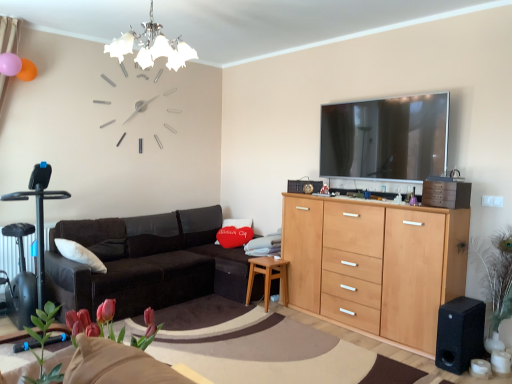
I want to click on green leafy plant at lower left, the first plant viewed from the left, so click(42, 344).

What do you see at coordinates (42, 344) in the screenshot? I see `green leafy plant at lower left, arranged as the first plant when viewed from the front` at bounding box center [42, 344].

The height and width of the screenshot is (384, 512). What do you see at coordinates (234, 236) in the screenshot?
I see `velvety red heart at center` at bounding box center [234, 236].

Find the location of `black matte speaker at lower right`. black matte speaker at lower right is located at coordinates (460, 334).

Measure the distance between beech wood cabinet at center and camera.

beech wood cabinet at center is 3.03 meters away from camera.

Describe the element at coordinates (147, 262) in the screenshot. I see `black leather couch at center` at that location.

In order to face black leather couch at center, should I rotate leftwards or rightwards?

Turn left approximately 10.867 degrees to face it.

The image size is (512, 384). What are the coordinates of `chrome/textured glass chandelier at upper center` in the screenshot? It's located at (151, 46).

This screenshot has height=384, width=512. What do you see at coordinates (151, 46) in the screenshot?
I see `chrome/textured glass chandelier at upper center` at bounding box center [151, 46].

This screenshot has width=512, height=384. Find the location of `pink matte tulips at lower left, the second plant from the right`. pink matte tulips at lower left, the second plant from the right is located at coordinates (94, 322).

Locate an element on the screen. green leafy plant at lower left, the first plant viewed from the left is located at coordinates (42, 344).

Is pink rubber balloon at upper left, marked as the 1th balloon in a front-to-back arrangement, at the right side of velvety red heart at center?

No.

Who is smaller, pink rubber balloon at upper left, marked as the 1th balloon in a front-to-back arrangement, or velvety red heart at center?

Smaller between the two is pink rubber balloon at upper left, marked as the 1th balloon in a front-to-back arrangement.

Considering the positions of objects pink rubber balloon at upper left, which ranks as the 2th balloon in back-to-front order, and velvety red heart at center in the image provided, who is behind, pink rubber balloon at upper left, which ranks as the 2th balloon in back-to-front order, or velvety red heart at center?

velvety red heart at center.

From the image's perspective, would you say pink rubber balloon at upper left, which ranks as the 2th balloon in back-to-front order, is positioned over beech wood cabinet at center?

Yes, from the image's perspective, pink rubber balloon at upper left, which ranks as the 2th balloon in back-to-front order, is above beech wood cabinet at center.

Consider the image. Is pink rubber balloon at upper left, which ranks as the 2th balloon in back-to-front order, inside the boundaries of beech wood cabinet at center, or outside?

pink rubber balloon at upper left, which ranks as the 2th balloon in back-to-front order, is spatially situated outside beech wood cabinet at center.

Does pink rubber balloon at upper left, marked as the 1th balloon in a front-to-back arrangement, have a lesser width compared to beech wood cabinet at center?

Yes.

Locate an element on the screen. chest of drawers to the right of pink rubber balloon at upper left, marked as the 1th balloon in a front-to-back arrangement is located at coordinates (375, 265).

This screenshot has width=512, height=384. There is a beech wood cabinet at center. Identify the location of the 1st plant above it (from a real-world perspective). (495, 280).

Is beech wood cabinet at center completely or partially outside of green leafy plant at right, placed as the 3th plant when sorted from front to back?

Yes, beech wood cabinet at center is located beyond the bounds of green leafy plant at right, placed as the 3th plant when sorted from front to back.

Can you confirm if beech wood cabinet at center is positioned to the left of green leafy plant at right, placed as the 3th plant when sorted from front to back?

Yes, beech wood cabinet at center is to the left of green leafy plant at right, placed as the 3th plant when sorted from front to back.

Is green leafy plant at lower left, the third plant viewed from the right, not within black leather couch at center?

Yes.

From a real-world perspective, is green leafy plant at lower left, the first plant viewed from the left, positioned under black leather couch at center based on gravity?

No, from a real-world perspective, green leafy plant at lower left, the first plant viewed from the left, is not under black leather couch at center.

From the image's perspective, is green leafy plant at lower left, the third plant viewed from the right, positioned above or below black leather couch at center?

From the image's perspective, green leafy plant at lower left, the third plant viewed from the right, appears above black leather couch at center.

Considering the relative sizes of green leafy plant at lower left, the third plant viewed from the right, and black leather couch at center in the image provided, is green leafy plant at lower left, the third plant viewed from the right, thinner than black leather couch at center?

Yes.

How different are the orientations of green leafy plant at right, which ranks as the 1th plant in right-to-left order, and black leather couch at center in degrees?

90.3 degrees separate the facing orientations of green leafy plant at right, which ranks as the 1th plant in right-to-left order, and black leather couch at center.

Where is `plant that appears below the black leather couch at center (from the image's perspective)`? The width and height of the screenshot is (512, 384). plant that appears below the black leather couch at center (from the image's perspective) is located at coordinates (495, 280).

Is green leafy plant at right, placed as the 3th plant when sorted from front to back, touching black leather couch at center?

green leafy plant at right, placed as the 3th plant when sorted from front to back, is not next to black leather couch at center, and they're not touching.

Considering the relative sizes of green leafy plant at right, which ranks as the 1th plant in right-to-left order, and black leather couch at center in the image provided, is green leafy plant at right, which ranks as the 1th plant in right-to-left order, smaller than black leather couch at center?

Yes.

Is matte orange balloon at upper left, the second balloon viewed from the front, not within green leafy plant at lower left, arranged as the first plant when viewed from the front?

matte orange balloon at upper left, the second balloon viewed from the front, is positioned outside green leafy plant at lower left, arranged as the first plant when viewed from the front.

Is matte orange balloon at upper left, the 1th balloon in the back-to-front sequence, aimed at green leafy plant at lower left, the first plant viewed from the left?

Yes, matte orange balloon at upper left, the 1th balloon in the back-to-front sequence, is oriented towards green leafy plant at lower left, the first plant viewed from the left.

Does matte orange balloon at upper left, the second balloon viewed from the front, have a lesser height compared to green leafy plant at lower left, the third plant viewed from the right?

Yes.

How different are the orientations of matte orange balloon at upper left, the second balloon viewed from the front, and green leafy plant at lower left, which is counted as the 3th plant, starting from the back, in degrees?

The angle between the facing direction of matte orange balloon at upper left, the second balloon viewed from the front, and the facing direction of green leafy plant at lower left, which is counted as the 3th plant, starting from the back, is 96.4 degrees.

Which object is further away from the camera, beech wood cabinet at center or light brown wooden side table at lower center?

Positioned behind is light brown wooden side table at lower center.

Which is correct: beech wood cabinet at center is inside light brown wooden side table at lower center, or outside of it?

beech wood cabinet at center is not inside light brown wooden side table at lower center, it's outside.

Is beech wood cabinet at center positioned with its back to light brown wooden side table at lower center?

No, light brown wooden side table at lower center is not at the back of beech wood cabinet at center.

Which is more to the right, beech wood cabinet at center or light brown wooden side table at lower center?

From the viewer's perspective, beech wood cabinet at center appears more on the right side.

The image size is (512, 384). I want to click on flower that is behind the pink rubber balloon at upper left, which ranks as the 2th balloon in back-to-front order, so click(x=234, y=236).

The image size is (512, 384). I want to click on chest of drawers below the pink rubber balloon at upper left, marked as the 1th balloon in a front-to-back arrangement (from a real-world perspective), so click(375, 265).

Based on the photo, estimate the real-world distances between objects in this image. Which object is further from light brown wooden side table at lower center, matte orange balloon at upper left, the second balloon viewed from the front, or black matte speaker at lower right?

matte orange balloon at upper left, the second balloon viewed from the front, lies further to light brown wooden side table at lower center than the other object.

From the image, which object appears to be farther from beech wood cabinet at center, black plastic swivel chair at left or chrome/textured glass chandelier at upper center?

The object further to beech wood cabinet at center is black plastic swivel chair at left.

Considering their positions, is pink rubber balloon at upper left, marked as the 1th balloon in a front-to-back arrangement, positioned closer to green leafy plant at right, which is the third plant from left to right, than black matte speaker at lower right?

black matte speaker at lower right is positioned closer to the anchor green leafy plant at right, which is the third plant from left to right.

Looking at the image, which one is located closer to green leafy plant at right, the 1th plant when ordered from back to front, beech wood cabinet at center or pink rubber balloon at upper left, marked as the 1th balloon in a front-to-back arrangement?

beech wood cabinet at center lies closer to green leafy plant at right, the 1th plant when ordered from back to front, than the other object.

Based on their spatial positions, is chrome/textured glass chandelier at upper center or green leafy plant at lower left, arranged as the first plant when viewed from the front, closer to black matte speaker at lower right?

Among the two, green leafy plant at lower left, arranged as the first plant when viewed from the front, is located nearer to black matte speaker at lower right.

From the image, which object appears to be farther from beech wood cabinet at center, black leather couch at center or pink matte tulips at lower left, which appears as the 2th plant when viewed from the left?

pink matte tulips at lower left, which appears as the 2th plant when viewed from the left, is further to beech wood cabinet at center.

Considering their positions, is pink matte tulips at lower left, arranged as the second plant when viewed from the back, positioned further to green leafy plant at lower left, arranged as the first plant when viewed from the front, than black leather couch at center?

Among the two, black leather couch at center is located further to green leafy plant at lower left, arranged as the first plant when viewed from the front.

Based on their spatial positions, is beech wood cabinet at center or light brown wooden side table at lower center further from matte orange balloon at upper left, the second balloon viewed from the front?

beech wood cabinet at center lies further to matte orange balloon at upper left, the second balloon viewed from the front, than the other object.

Locate an element on the screen. Image resolution: width=512 pixels, height=384 pixels. flower situated between pink rubber balloon at upper left, marked as the 1th balloon in a front-to-back arrangement, and black matte speaker at lower right from left to right is located at coordinates (234, 236).

I want to click on studio couch between black plastic swivel chair at left and velvety red heart at center along the z-axis, so click(x=147, y=262).

Identify the location of swivel chair between green leafy plant at lower left, which is counted as the 3th plant, starting from the back, and pink rubber balloon at upper left, which ranks as the 2th balloon in back-to-front order, along the z-axis. The height and width of the screenshot is (384, 512). (38, 247).

Identify the location of balloon between pink rubber balloon at upper left, which ranks as the 2th balloon in back-to-front order, and chrome/textured glass chandelier at upper center. Image resolution: width=512 pixels, height=384 pixels. pyautogui.click(x=27, y=70).